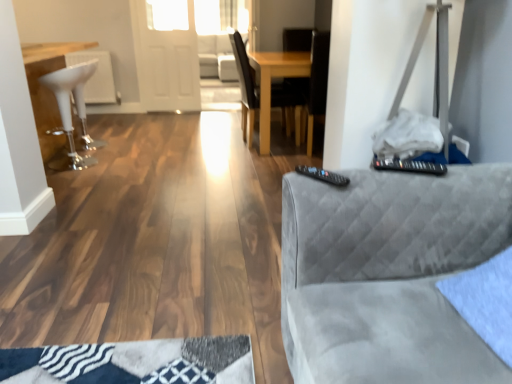
Question: Is transparent glass door at upper center smaller than black plastic remote at upper right?

Choices:
 (A) no
 (B) yes

Answer: (A)

Question: Is transparent glass door at upper center to the right of black plastic remote at upper right from the viewer's perspective?

Choices:
 (A) yes
 (B) no

Answer: (B)

Question: Would you say transparent glass door at upper center is outside black plastic remote at upper right?

Choices:
 (A) yes
 (B) no

Answer: (A)

Question: From the image's perspective, would you say transparent glass door at upper center is positioned over black plastic remote at upper right?

Choices:
 (A) no
 (B) yes

Answer: (B)

Question: Considering the relative positions of transparent glass door at upper center and black plastic remote at upper right in the image provided, is transparent glass door at upper center behind black plastic remote at upper right?

Choices:
 (A) no
 (B) yes

Answer: (B)

Question: Does transparent glass door at upper center have a lesser height compared to black plastic remote at upper right?

Choices:
 (A) yes
 (B) no

Answer: (B)

Question: From a real-world perspective, is transparent glass door at upper center on white glossy bar stool at left?

Choices:
 (A) yes
 (B) no

Answer: (A)

Question: Can you confirm if transparent glass door at upper center is wider than white glossy bar stool at left?

Choices:
 (A) no
 (B) yes

Answer: (A)

Question: Does transparent glass door at upper center have a larger size compared to white glossy bar stool at left?

Choices:
 (A) no
 (B) yes

Answer: (A)

Question: Is transparent glass door at upper center positioned far away from white glossy bar stool at left?

Choices:
 (A) yes
 (B) no

Answer: (A)

Question: Is transparent glass door at upper center looking in the opposite direction of white glossy bar stool at left?

Choices:
 (A) no
 (B) yes

Answer: (A)

Question: Is transparent glass door at upper center completely or partially outside of white glossy bar stool at left?

Choices:
 (A) no
 (B) yes

Answer: (B)

Question: From a real-world perspective, is white glossy bar stool at left physically below black plastic remote at right?

Choices:
 (A) no
 (B) yes

Answer: (B)